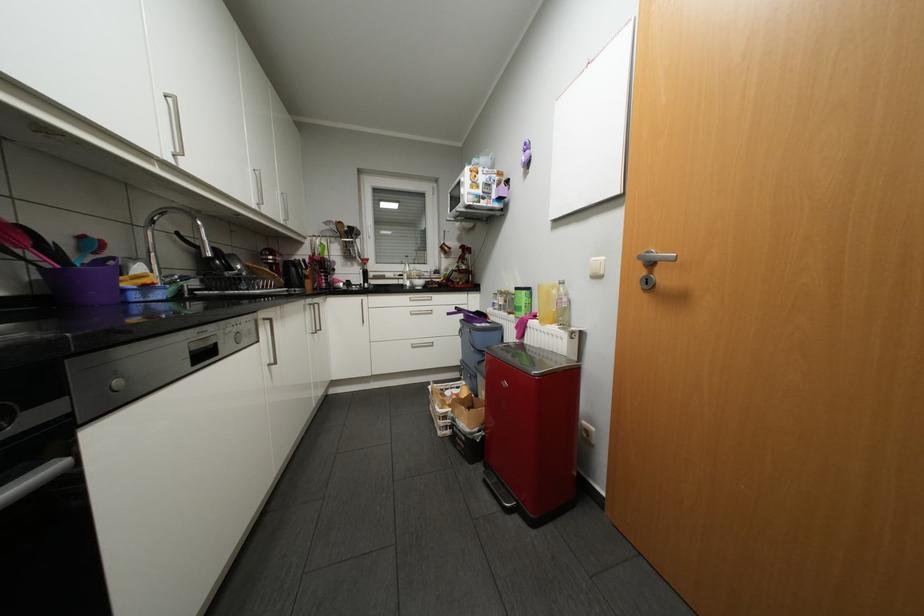
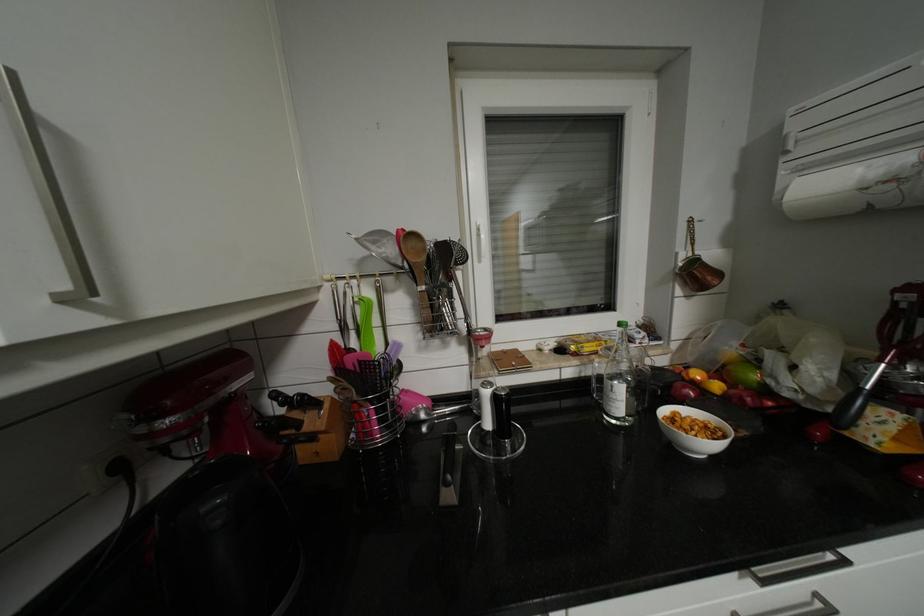
The point at (428,282) is marked in the first image. Where is the corresponding point in the second image?

(703, 430)